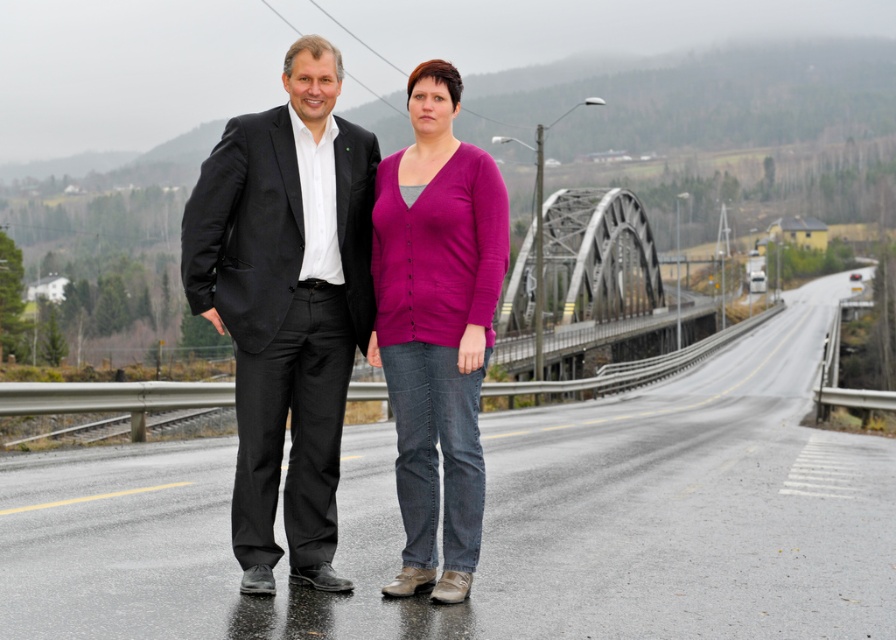
Does asphalt road at center have a lesser width compared to matte black suit at center?

No.

Is point (784, 616) less distant than point (323, 205)?

That is True.

The height and width of the screenshot is (640, 896). What do you see at coordinates (504, 522) in the screenshot?
I see `asphalt road at center` at bounding box center [504, 522].

Locate an element on the screen. This screenshot has height=640, width=896. asphalt road at center is located at coordinates (504, 522).

Is matte black suit at center shorter than purple cardigan at center?

No, matte black suit at center is not shorter than purple cardigan at center.

Can you confirm if matte black suit at center is positioned above purple cardigan at center?

No, matte black suit at center is not above purple cardigan at center.

Is point (311, 134) positioned behind point (458, 259)?

That is True.

I want to click on matte black suit at center, so click(286, 304).

Who is positioned more to the right, matte black suit at center or steel bridge at center?

Positioned to the right is steel bridge at center.

Is matte black suit at center taller than steel bridge at center?

Incorrect, matte black suit at center's height is not larger of steel bridge at center's.

Measure the distance between matte black suit at center and camera.

matte black suit at center is 5.79 meters away from camera.

Locate an element on the screen. matte black suit at center is located at coordinates (286, 304).